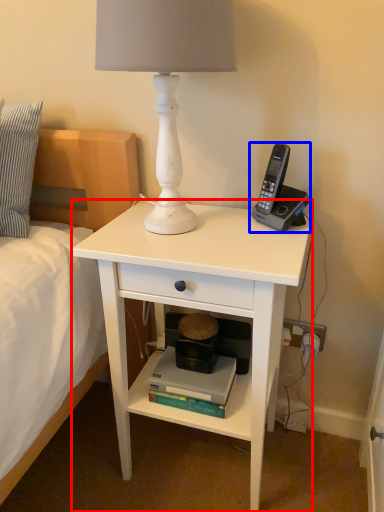
Question: Among these objects, which one is nearest to the camera, desk (highlighted by a red box) or corded phone (highlighted by a blue box)?

Choices:
 (A) desk
 (B) corded phone

Answer: (A)